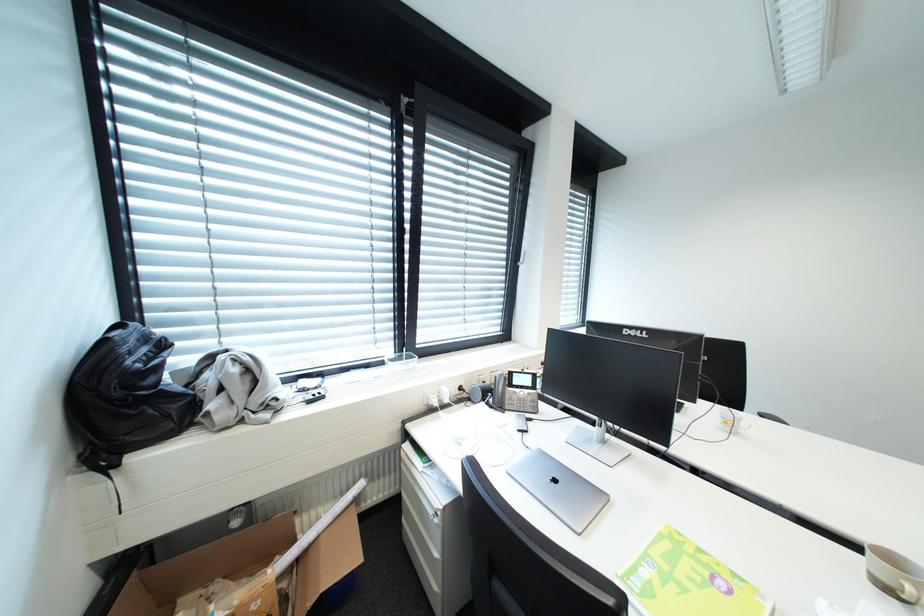
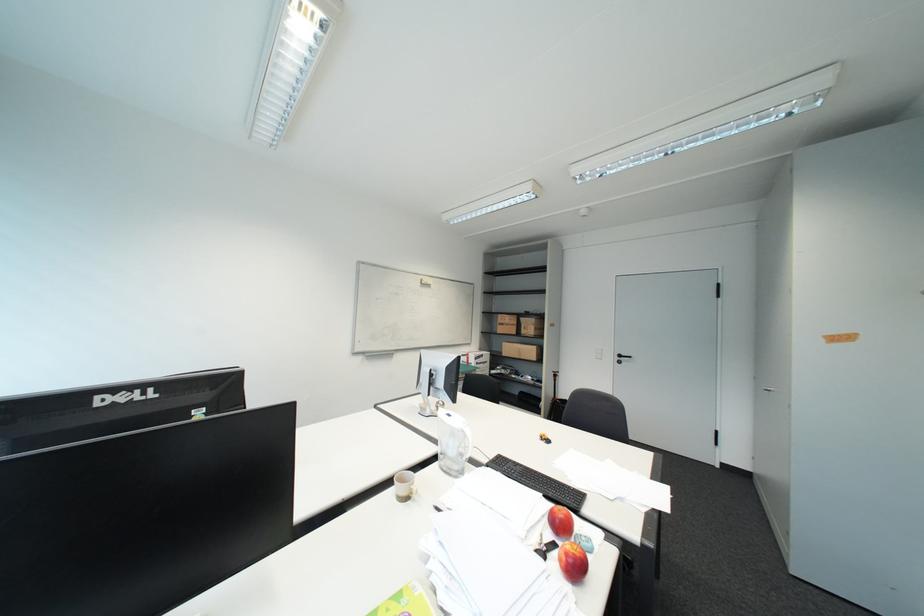
Question: The first image is from the beginning of the video and the second image is from the end. How did the camera likely rotate when shooting the video?

Choices:
 (A) Left
 (B) Right
 (C) Up
 (D) Down

Answer: (B)